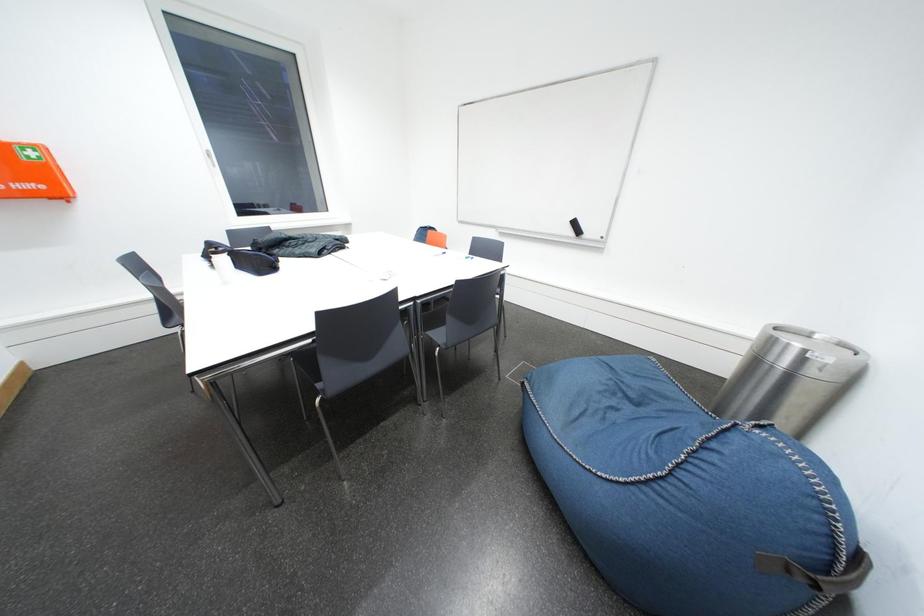
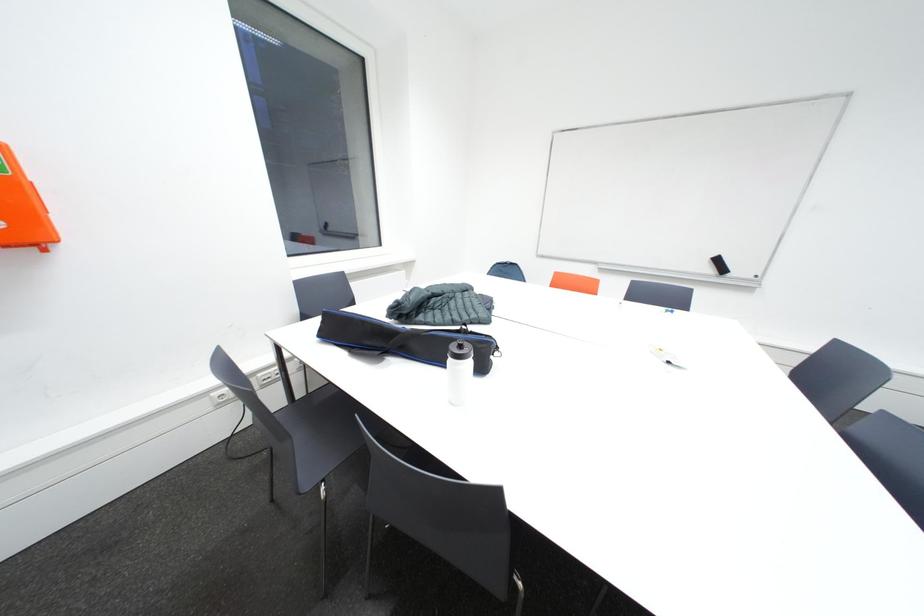
In a continuous first-person perspective shot, in which direction is the camera moving?

The cameraman walked toward left, forward.